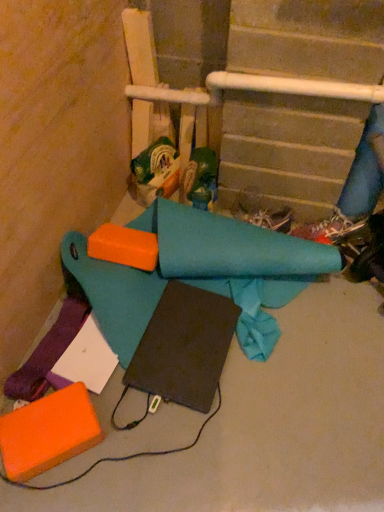
Question: Can you confirm if purple fabric at lower left, which appears as the third fabric when viewed from the right, is wider than shiny black shoe at lower right?

Choices:
 (A) no
 (B) yes

Answer: (B)

Question: Is purple fabric at lower left, which ranks as the 1th fabric in left-to-right order, to the right of shiny black shoe at lower right from the viewer's perspective?

Choices:
 (A) yes
 (B) no

Answer: (B)

Question: Does purple fabric at lower left, which ranks as the 1th fabric in left-to-right order, have a larger size compared to shiny black shoe at lower right?

Choices:
 (A) yes
 (B) no

Answer: (B)

Question: From a real-world perspective, is purple fabric at lower left, which ranks as the 1th fabric in left-to-right order, located beneath shiny black shoe at lower right?

Choices:
 (A) yes
 (B) no

Answer: (B)

Question: Is purple fabric at lower left, which ranks as the 1th fabric in left-to-right order, not near shiny black shoe at lower right?

Choices:
 (A) yes
 (B) no

Answer: (B)

Question: From the image's perspective, relative to shiny black shoe at lower right, is purple fabric at lower left, which appears as the third fabric when viewed from the right, above or below?

Choices:
 (A) above
 (B) below

Answer: (B)

Question: Relative to shiny black shoe at lower right, is purple fabric at lower left, which ranks as the 1th fabric in left-to-right order, in front or behind?

Choices:
 (A) behind
 (B) front

Answer: (B)

Question: Considering the positions of point (51, 352) and point (331, 230), is point (51, 352) closer or farther from the camera than point (331, 230)?

Choices:
 (A) closer
 (B) farther

Answer: (A)

Question: Considering the positions of purple fabric at lower left, which appears as the third fabric when viewed from the right, and shiny black shoe at lower right in the image, is purple fabric at lower left, which appears as the third fabric when viewed from the right, taller or shorter than shiny black shoe at lower right?

Choices:
 (A) tall
 (B) short

Answer: (B)

Question: Considering the positions of teal fabric cone at center, placed as the first toy when sorted from right to left, and teal fabric at center, marked as the second fabric in a left-to-right arrangement, in the image, is teal fabric cone at center, placed as the first toy when sorted from right to left, taller or shorter than teal fabric at center, marked as the second fabric in a left-to-right arrangement,?

Choices:
 (A) short
 (B) tall

Answer: (B)

Question: From the image's perspective, relative to teal fabric at center, marked as the second fabric in a left-to-right arrangement, is teal fabric cone at center, placed as the first toy when sorted from right to left, above or below?

Choices:
 (A) above
 (B) below

Answer: (A)

Question: Considering the positions of teal fabric cone at center, placed as the first toy when sorted from right to left, and teal fabric at center, marked as the second fabric in a left-to-right arrangement, in the image, is teal fabric cone at center, placed as the first toy when sorted from right to left, wider or thinner than teal fabric at center, marked as the second fabric in a left-to-right arrangement,?

Choices:
 (A) thin
 (B) wide

Answer: (A)

Question: Considering the relative positions of teal fabric cone at center, marked as the second toy in a left-to-right arrangement, and teal fabric at center, which is the second fabric from right to left, in the image provided, is teal fabric cone at center, marked as the second toy in a left-to-right arrangement, to the left or to the right of teal fabric at center, which is the second fabric from right to left,?

Choices:
 (A) right
 (B) left

Answer: (A)

Question: In terms of height, does shiny black shoe at lower right look taller or shorter compared to teal fabric at center, marked as the second fabric in a left-to-right arrangement?

Choices:
 (A) tall
 (B) short

Answer: (B)

Question: Based on their positions, is shiny black shoe at lower right located to the left or right of teal fabric at center, marked as the second fabric in a left-to-right arrangement?

Choices:
 (A) left
 (B) right

Answer: (B)